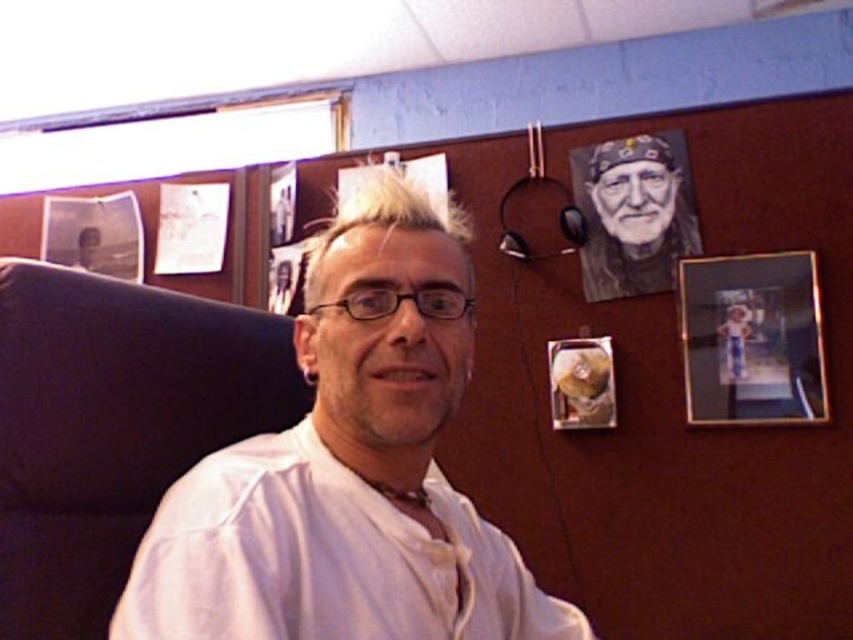
Consider the image. You are standing in the office and want to sit down. The black fabric swivel chair at left is located at coordinates point (113, 426). Can you estimate where this chair is positioned relative to the person in the image?

The black fabric swivel chair at left is located at point (113, 426), which is to the left side of the person in the image.

Based on the scene description, where is the black fabric swivel chair at left located in terms of its 2D coordinates?

The black fabric swivel chair at left is located at the 2D coordinates of point [113,426].

Consider the image. You are organizing a small party in this office space. You need to place a large decorative item that requires a sturdy surface. Which object between the black fabric swivel chair at left and the gold metallic photo frame at upper right would be more suitable for placing the item?

The black fabric swivel chair at left has a larger size compared to the gold metallic photo frame at upper right, making it more stable and suitable for placing a large decorative item that requires a sturdy surface.